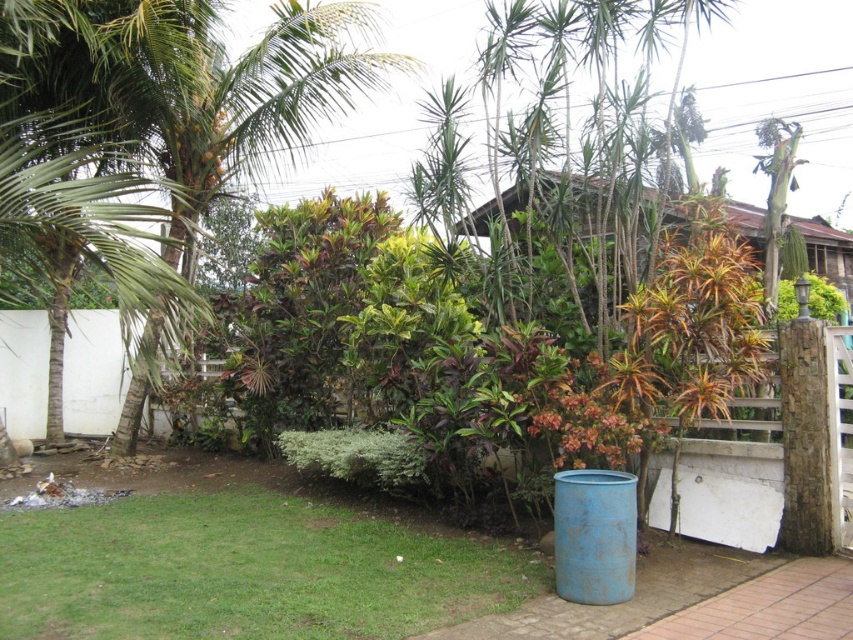
Looking at this image, can you confirm if green leafy palm tree at left is shorter than brown wooden hut at upper center?

Incorrect, green leafy palm tree at left's height does not fall short of brown wooden hut at upper center's.

Who is more distant from viewer, (206, 33) or (668, 198)?

The point (206, 33) is behind.

Between point (305, 125) and point (535, 180), which one is positioned behind?

Positioned behind is point (305, 125).

Where is `green leafy palm tree at left`? green leafy palm tree at left is located at coordinates (170, 113).

Can you confirm if green leafy palm tree at left is positioned to the left of green grass at lower left?

Correct, you'll find green leafy palm tree at left to the left of green grass at lower left.

Between green leafy palm tree at left and green grass at lower left, which one has more height?

Standing taller between the two is green leafy palm tree at left.

Which is in front, point (361, 8) or point (363, 556)?

Point (363, 556)

You are a GUI agent. You are given a task and a screenshot of the screen. Output one action in this format:
    pyautogui.click(x=<x>, y=<y>)
    Task: Click on the green leafy palm tree at left
    Image resolution: width=853 pixels, height=640 pixels.
    Given the screenshot: What is the action you would take?
    tap(170, 113)

Is green grass at lower left further to camera compared to brown wooden hut at upper center?

No.

Who is more distant from viewer, (332, 625) or (751, 232)?

Point (751, 232)

Where is `green grass at lower left`? The height and width of the screenshot is (640, 853). green grass at lower left is located at coordinates (245, 570).

This screenshot has width=853, height=640. I want to click on green grass at lower left, so click(245, 570).